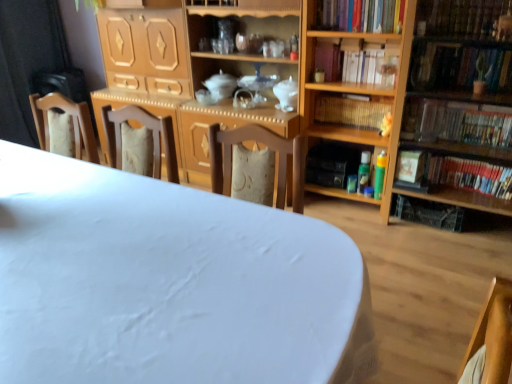
This screenshot has width=512, height=384. What do you see at coordinates (354, 93) in the screenshot? I see `wooden bookshelf at right, which is the 2th shelf from right to left` at bounding box center [354, 93].

This screenshot has height=384, width=512. Find the location of `hardcover books at upper right, the first book from the top`. hardcover books at upper right, the first book from the top is located at coordinates (361, 15).

What do you see at coordinates (460, 106) in the screenshot?
I see `wooden bookshelf at right, marked as the 1th shelf in a right-to-left arrangement` at bounding box center [460, 106].

What is the approximate width of wooden bookshelf at right, marked as the 1th shelf in a right-to-left arrangement?

The width of wooden bookshelf at right, marked as the 1th shelf in a right-to-left arrangement, is 28.56 inches.

The width and height of the screenshot is (512, 384). What do you see at coordinates (464, 176) in the screenshot?
I see `hardcover book at right, the sixth book positioned from the top` at bounding box center [464, 176].

Describe the element at coordinates (351, 111) in the screenshot. The width and height of the screenshot is (512, 384). I see `wooden bookshelf at center, the fourth book from the top` at that location.

What is the approximate width of wooden bookshelf at center, the fourth book from the top?

It is 18.51 centimeters.

From the picture: Measure the distance between point (x=42, y=307) and camera.

They are 91.80 centimeters apart.

Find the location of `wooden bookshelf at right, which is the 2th shelf from right to left`. wooden bookshelf at right, which is the 2th shelf from right to left is located at coordinates (354, 93).

You are a GUI agent. You are given a task and a screenshot of the screen. Output one action in this format:
    pyautogui.click(x=<x>, y=<y>)
    Task: Click on the 4th book located above the wooden bookshelf at center, positioned as the third book in bottom-to-top order (from a real-world perspective)
    
    Given the screenshot: What is the action you would take?
    pyautogui.click(x=361, y=15)

Is wooden bookshelf at center, the fourth book from the top, bigger or smaller than hardcover books at upper right, arranged as the sixth book when ordered from the bottom?

Clearly, wooden bookshelf at center, the fourth book from the top, is smaller in size than hardcover books at upper right, arranged as the sixth book when ordered from the bottom.

From the image's perspective, which is above, wooden bookshelf at center, positioned as the third book in bottom-to-top order, or hardcover books at upper right, the first book from the top?

hardcover books at upper right, the first book from the top, from the image's perspective.

Is wooden bookshelf at center, the fourth book from the top, oriented away from hardcover books at upper right, arranged as the sixth book when ordered from the bottom?

No, hardcover books at upper right, arranged as the sixth book when ordered from the bottom, is not at the back of wooden bookshelf at center, the fourth book from the top.

Which object is positioned more to the left, white matte table at center or hardcover books at upper right, which is counted as the 2th book, starting from the top?

→ From the viewer's perspective, white matte table at center appears more on the left side.

Is there a large distance between white matte table at center and hardcover books at upper right, which is counted as the 5th book, starting from the bottom?

Yes, white matte table at center and hardcover books at upper right, which is counted as the 5th book, starting from the bottom, are quite far apart.

In terms of size, does white matte table at center appear bigger or smaller than hardcover books at upper right, which is counted as the 2th book, starting from the top?

In the image, white matte table at center appears to be larger than hardcover books at upper right, which is counted as the 2th book, starting from the top.

How many degrees apart are the facing directions of white matte table at center and hardcover books at upper right, which is counted as the 5th book, starting from the bottom?

The angular difference between white matte table at center and hardcover books at upper right, which is counted as the 5th book, starting from the bottom, is 2.81 degrees.

Is hardcover books at upper right, which is counted as the 5th book, starting from the bottom, far away from wooden bookshelf at center, the fourth book from the top?

hardcover books at upper right, which is counted as the 5th book, starting from the bottom, is actually quite close to wooden bookshelf at center, the fourth book from the top.

How many degrees apart are the facing directions of hardcover books at upper right, which is counted as the 5th book, starting from the bottom, and wooden bookshelf at center, the fourth book from the top?

The angle between the facing direction of hardcover books at upper right, which is counted as the 5th book, starting from the bottom, and the facing direction of wooden bookshelf at center, the fourth book from the top, is 0.000239 degrees.

Is wooden bookshelf at center, positioned as the third book in bottom-to-top order, a part of hardcover books at upper right, which is counted as the 5th book, starting from the bottom?

Definitely not — wooden bookshelf at center, positioned as the third book in bottom-to-top order, is not inside hardcover books at upper right, which is counted as the 5th book, starting from the bottom.

From the image's perspective, which one is positioned higher, hardcover books at upper right, which is counted as the 2th book, starting from the top, or wooden bookshelf at center, positioned as the third book in bottom-to-top order?

From the image's view, hardcover books at upper right, which is counted as the 2th book, starting from the top, is above.

Is hardcover book at right, the first book when ordered from bottom to top, further to the viewer compared to wooden bookshelf at right, positioned as the 2th shelf in left-to-right order?

Yes.

Based on the photo, how different are the orientations of hardcover book at right, the first book when ordered from bottom to top, and wooden bookshelf at right, marked as the 1th shelf in a right-to-left arrangement, in degrees?

They differ by 0.0786 degrees in their facing directions.

Which is less distant, (456, 179) or (434, 69)?

Point (456, 179) is farther from the camera than point (434, 69).

From a real-world perspective, does hardcover book at right, the first book when ordered from bottom to top, sit lower than wooden bookshelf at right, positioned as the 2th shelf in left-to-right order?

Yes, from a real-world perspective, hardcover book at right, the first book when ordered from bottom to top, is below wooden bookshelf at right, positioned as the 2th shelf in left-to-right order.

How much distance is there between hardcover book at right and wooden chair at left?

hardcover book at right and wooden chair at left are 5.70 feet apart from each other.

Is there a large distance between hardcover book at right and wooden chair at left?

hardcover book at right is far away from wooden chair at left.

Does point (403, 162) appear closer or farther from the camera than point (81, 121)?

Point (403, 162) is positioned farther from the camera compared to point (81, 121).

Considering the sizes of objects hardcover book at right and wooden chair at left in the image provided, who is smaller, hardcover book at right or wooden chair at left?

hardcover book at right.

From the picture: From the image's perspective, is wooden bookshelf at center, positioned as the third book in bottom-to-top order, on top of hardcover book at right, the sixth book positioned from the top?

Yes, from the image's perspective, wooden bookshelf at center, positioned as the third book in bottom-to-top order, is over hardcover book at right, the sixth book positioned from the top.

Looking at this image, which of these two, wooden bookshelf at center, the fourth book from the top, or hardcover book at right, the first book when ordered from bottom to top, is bigger?

Bigger between the two is wooden bookshelf at center, the fourth book from the top.

Between wooden bookshelf at center, positioned as the third book in bottom-to-top order, and hardcover book at right, the first book when ordered from bottom to top, which one has larger width?

With larger width is wooden bookshelf at center, positioned as the third book in bottom-to-top order.

Looking at this image, is wooden bookshelf at center, the fourth book from the top, directly adjacent to hardcover book at right, the sixth book positioned from the top?

There is a gap between wooden bookshelf at center, the fourth book from the top, and hardcover book at right, the sixth book positioned from the top.

Are white matte table at center and wooden bookshelf at right, positioned as the 2th shelf in left-to-right order, beside each other?

white matte table at center and wooden bookshelf at right, positioned as the 2th shelf in left-to-right order, are not in contact.

Could you tell me if white matte table at center is turned towards wooden bookshelf at right, marked as the 1th shelf in a right-to-left arrangement?

No, white matte table at center does not turn towards wooden bookshelf at right, marked as the 1th shelf in a right-to-left arrangement.

You are a GUI agent. You are given a task and a screenshot of the screen. Output one action in this format:
    pyautogui.click(x=<x>, y=<y>)
    Task: Click on the table in front of the wooden bookshelf at right, marked as the 1th shelf in a right-to-left arrangement
    
    Given the screenshot: What is the action you would take?
    pyautogui.click(x=169, y=283)

In the scene shown: From the image's perspective, is white matte table at center beneath wooden bookshelf at right, positioned as the 2th shelf in left-to-right order?

Yes, from the image's perspective, white matte table at center is beneath wooden bookshelf at right, positioned as the 2th shelf in left-to-right order.

Where is `the 3rd book below the hardcover books at upper right, arranged as the sixth book when ordered from the bottom (from the image's perspective)`? This screenshot has height=384, width=512. the 3rd book below the hardcover books at upper right, arranged as the sixth book when ordered from the bottom (from the image's perspective) is located at coordinates (351, 111).

Where is `the 5th book positioned above the white matte table at center (from the image's perspective)`? The image size is (512, 384). the 5th book positioned above the white matte table at center (from the image's perspective) is located at coordinates (367, 61).

Considering their positions, is wooden bookshelf at center, the fourth book from the top, positioned further to hardcover books at upper right, the first book from the top, than wooden chair at left?

wooden chair at left.

Considering their positions, is hardcover books at upper right, which is counted as the 5th book, starting from the bottom, positioned further to wooden bookshelf at right, positioned as the 2th shelf in left-to-right order, than hardcover book at right?

Based on the image, hardcover books at upper right, which is counted as the 5th book, starting from the bottom, appears to be further to wooden bookshelf at right, positioned as the 2th shelf in left-to-right order.

Estimate the real-world distances between objects in this image. Which object is closer to wooden bookshelf at center, positioned as the third book in bottom-to-top order, wooden bookshelf at right, the first shelf viewed from the left, or wooden bookshelf at right, marked as the 1th shelf in a right-to-left arrangement?

The object closer to wooden bookshelf at center, positioned as the third book in bottom-to-top order, is wooden bookshelf at right, the first shelf viewed from the left.

Estimate the real-world distances between objects in this image. Which object is further from green matte plant at upper right, which is the 4th book in bottom-to-top order, wooden bookshelf at center, positioned as the third book in bottom-to-top order, or wooden bookshelf at right, positioned as the 2th shelf in left-to-right order?

The object further to green matte plant at upper right, which is the 4th book in bottom-to-top order, is wooden bookshelf at center, positioned as the third book in bottom-to-top order.

Which object lies further to the anchor point hardcover book at right, the sixth book positioned from the top, wooden bookshelf at right, positioned as the 2th shelf in left-to-right order, or hardcover books at upper right, arranged as the sixth book when ordered from the bottom?

hardcover books at upper right, arranged as the sixth book when ordered from the bottom.

Estimate the real-world distances between objects in this image. Which object is closer to green matte plant at upper right, which is the 4th book in bottom-to-top order, wooden bookshelf at right, positioned as the 2th shelf in left-to-right order, or wooden bookshelf at center, the fourth book from the top?

Among the two, wooden bookshelf at right, positioned as the 2th shelf in left-to-right order, is located nearer to green matte plant at upper right, which is the 4th book in bottom-to-top order.

Considering their positions, is wooden bookshelf at center, the fourth book from the top, positioned further to hardcover books at upper right, which is counted as the 2th book, starting from the top, than wooden bookshelf at right, marked as the 1th shelf in a right-to-left arrangement?

wooden bookshelf at right, marked as the 1th shelf in a right-to-left arrangement, is positioned further to the anchor hardcover books at upper right, which is counted as the 2th book, starting from the top.

Looking at the image, which one is located closer to hardcover books at upper right, which is counted as the 5th book, starting from the bottom, wooden chair at left or hardcover book at right, the first book when ordered from bottom to top?

hardcover book at right, the first book when ordered from bottom to top, is positioned closer to the anchor hardcover books at upper right, which is counted as the 5th book, starting from the bottom.

You are a GUI agent. You are given a task and a screenshot of the screen. Output one action in this format:
    pyautogui.click(x=<x>, y=<y>)
    Task: Click on the shelf located between hardcover books at upper right, arranged as the sixth book when ordered from the bottom, and green matte plant at upper right, the 3th book from the top, in the left-right direction
    The image size is (512, 384).
    Given the screenshot: What is the action you would take?
    pyautogui.click(x=354, y=93)

Where is `book positioned between white matte table at center and wooden bookshelf at right, which is the 2th shelf from right to left, from near to far`? Image resolution: width=512 pixels, height=384 pixels. book positioned between white matte table at center and wooden bookshelf at right, which is the 2th shelf from right to left, from near to far is located at coordinates (459, 66).

Find the location of a particular element. paperback book between green matte plant at upper right, which is the 4th book in bottom-to-top order, and hardcover book at right, the first book when ordered from bottom to top, from top to bottom is located at coordinates (410, 166).

Locate an element on the screen. This screenshot has width=512, height=384. paperback book between white matte table at center and hardcover books at upper right, which is counted as the 5th book, starting from the bottom, from front to back is located at coordinates (410, 166).